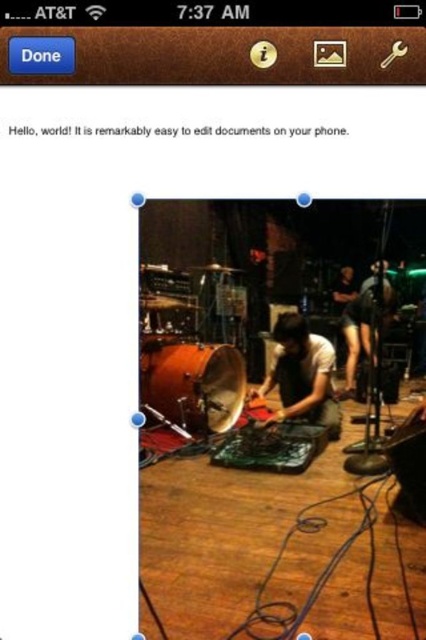
You are designing a layout for a mobile app and want to place the matte brown drum at center and the matte black shirt at center next to each other. Based on their sizes, which object should you place first to ensure they fit properly?

The matte brown drum at center is not as tall as the matte black shirt at center, so you should place the matte black shirt at center first to account for its greater height.

You are looking at a mobile device screen and see both the matte brown drum at center and the matte black shirt at center. Which object is positioned more to the left side of the screen?

The matte brown drum at center is positioned more to the left side of the screen compared to the matte black shirt at center.